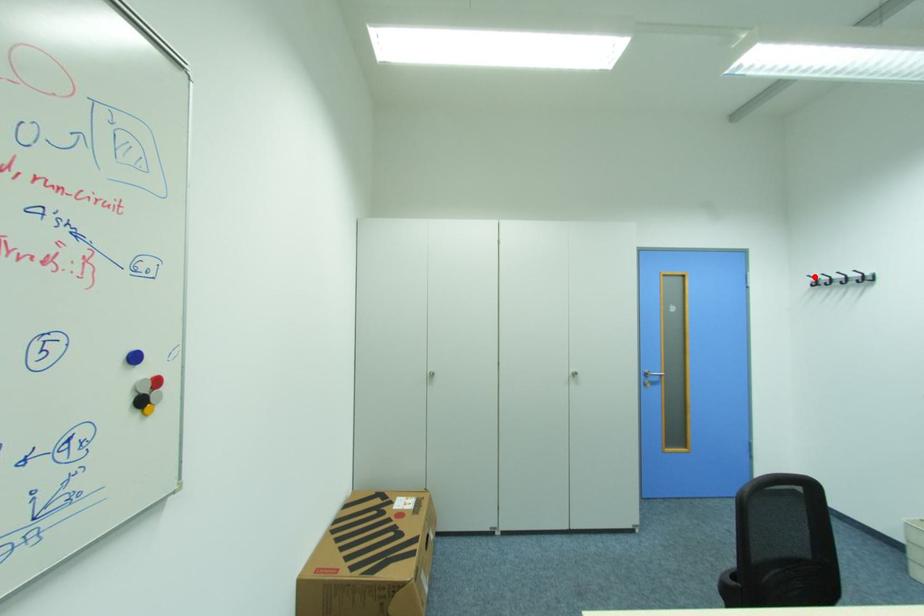
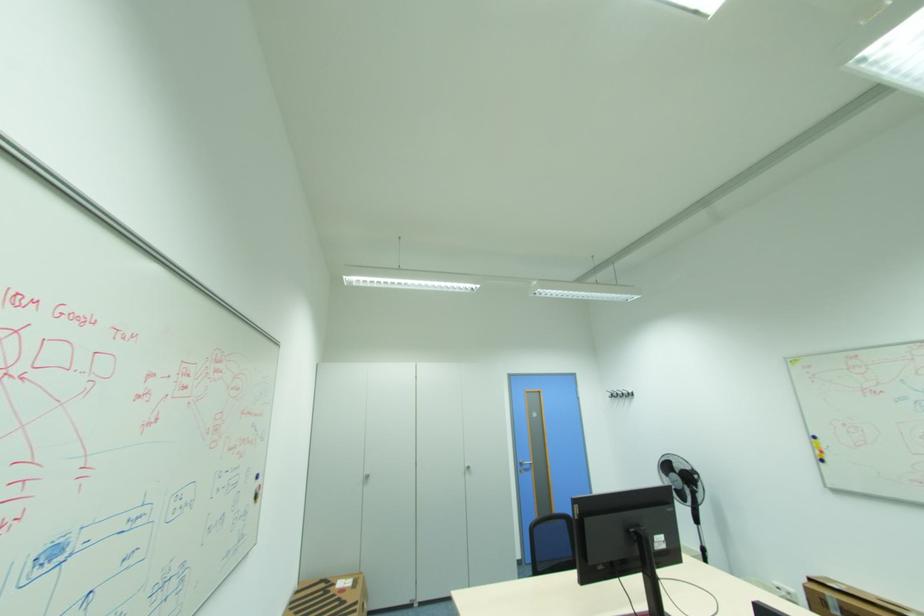
Question: I am providing you with two images of the same scene from different viewpoints. Given a red point in image1, look at the same physical point in image2. Is it:

Choices:
 (A) Closer to the viewpoint
 (B) Farther from the viewpoint

Answer: (B)